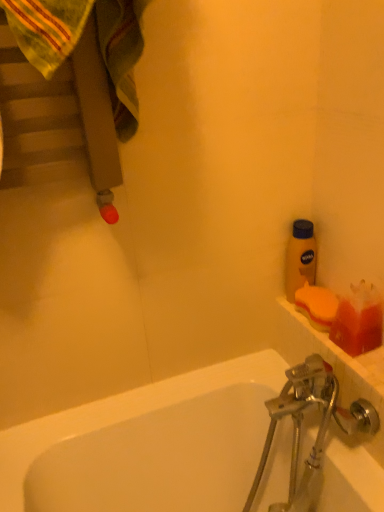
Describe the element at coordinates (358, 320) in the screenshot. I see `translucent orange soap at right` at that location.

You are a GUI agent. You are given a task and a screenshot of the screen. Output one action in this format:
    pyautogui.click(x=<x>, y=<y>)
    Task: Click on the yellow matte bottle at upper right
    The width and height of the screenshot is (384, 512).
    Given the screenshot: What is the action you would take?
    pyautogui.click(x=300, y=258)

Is yellow matte bottle at upper right not near translucent orange soap at right?

yellow matte bottle at upper right is actually quite close to translucent orange soap at right.

Can you confirm if yellow matte bottle at upper right is wider than translucent orange soap at right?

In fact, yellow matte bottle at upper right might be narrower than translucent orange soap at right.

Where is `bottle behind the translucent orange soap at right`? The height and width of the screenshot is (512, 384). bottle behind the translucent orange soap at right is located at coordinates (300, 258).

From the image's perspective, is yellow matte bottle at upper right below translucent orange soap at right?

No.

Does translucent orange soap at right have a lesser width compared to orange sponge at right?

Yes.

Would you say translucent orange soap at right is outside orange sponge at right?

Yes, translucent orange soap at right is located beyond the bounds of orange sponge at right.

Who is smaller, translucent orange soap at right or orange sponge at right?

Smaller between the two is translucent orange soap at right.

Considering their positions, is orange sponge at right located in front of or behind translucent orange soap at right?

orange sponge at right is behind translucent orange soap at right.

Considering the sizes of objects orange sponge at right and translucent orange soap at right in the image provided, who is thinner, orange sponge at right or translucent orange soap at right?

translucent orange soap at right is thinner.

Between orange sponge at right and translucent orange soap at right, which one appears on the left side from the viewer's perspective?

orange sponge at right.

How many degrees apart are the facing directions of orange sponge at right and translucent orange soap at right?

The facing directions of orange sponge at right and translucent orange soap at right are 0.00107 degrees apart.

Considering the sizes of orange sponge at right and yellow matte bottle at upper right in the image, is orange sponge at right bigger or smaller than yellow matte bottle at upper right?

orange sponge at right is smaller than yellow matte bottle at upper right.

Choose the correct answer: Is orange sponge at right inside yellow matte bottle at upper right or outside it?

orange sponge at right exists outside the volume of yellow matte bottle at upper right.

Consider the image. Is orange sponge at right positioned in front of yellow matte bottle at upper right?

Yes, it is in front of yellow matte bottle at upper right.

Does point (327, 298) come farther from viewer compared to point (299, 267)?

No.

Can you confirm if translucent orange soap at right is smaller than yellow matte bottle at upper right?

Yes, translucent orange soap at right is smaller than yellow matte bottle at upper right.

Can you confirm if translucent orange soap at right is positioned to the left of yellow matte bottle at upper right?

No.

From a real-world perspective, is translucent orange soap at right physically located above or below yellow matte bottle at upper right?

In terms of real-world spatial position, translucent orange soap at right is below yellow matte bottle at upper right.

From a real-world perspective, between yellow matte bottle at upper right and orange sponge at right, who is vertically higher?

yellow matte bottle at upper right.

Considering their positions, is yellow matte bottle at upper right located in front of or behind orange sponge at right?

Visually, yellow matte bottle at upper right is located behind orange sponge at right.

In terms of width, does yellow matte bottle at upper right look wider or thinner when compared to orange sponge at right?

Considering their sizes, yellow matte bottle at upper right looks slimmer than orange sponge at right.

Does yellow matte bottle at upper right have a larger size compared to orange sponge at right?

Yes.

This screenshot has height=512, width=384. In order to click on bottle above the translucent orange soap at right (from a real-world perspective) in this screenshot , I will do `click(300, 258)`.

At what (x,y) coordinates should I click in order to perform the action: click on soap to the left of translucent orange soap at right. Please return your answer as a coordinate pair (x, y). The height and width of the screenshot is (512, 384). Looking at the image, I should click on (317, 305).

Estimate the real-world distances between objects in this image. Which object is further from yellow matte bottle at upper right, orange sponge at right or translucent orange soap at right?

translucent orange soap at right lies further to yellow matte bottle at upper right than the other object.

Looking at the image, which one is located further to translucent orange soap at right, orange sponge at right or yellow matte bottle at upper right?

Based on the image, yellow matte bottle at upper right appears to be further to translucent orange soap at right.

Which object lies nearer to the anchor point yellow matte bottle at upper right, translucent orange soap at right or orange sponge at right?

Among the two, orange sponge at right is located nearer to yellow matte bottle at upper right.

From the image, which object appears to be nearer to orange sponge at right, yellow matte bottle at upper right or translucent orange soap at right?

The object closer to orange sponge at right is translucent orange soap at right.

Estimate the real-world distances between objects in this image. Which object is further from translucent orange soap at right, yellow matte bottle at upper right or orange sponge at right?

Based on the image, yellow matte bottle at upper right appears to be further to translucent orange soap at right.

From the image, which object appears to be farther from orange sponge at right, translucent orange soap at right or yellow matte bottle at upper right?

yellow matte bottle at upper right is positioned further to the anchor orange sponge at right.

At what (x,y) coordinates should I click in order to perform the action: click on soap between translucent orange soap at right and yellow matte bottle at upper right along the z-axis. Please return your answer as a coordinate pair (x, y). Looking at the image, I should click on (317, 305).